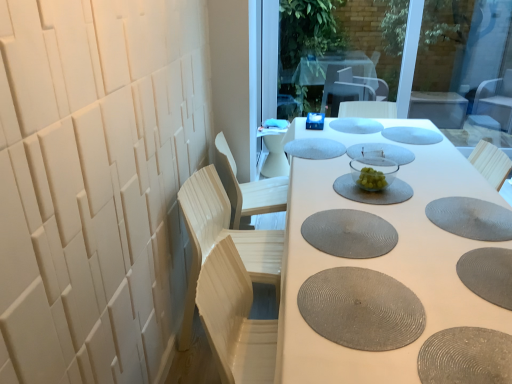
Find the location of a particular element. This screenshot has height=384, width=512. vacant space that is in between blue fabric cushion at center, the first manhole cover in the back-to-front sequence, and clear glass bowl at center, which is the fourth manhole cover in back-to-front order is located at coordinates (352, 135).